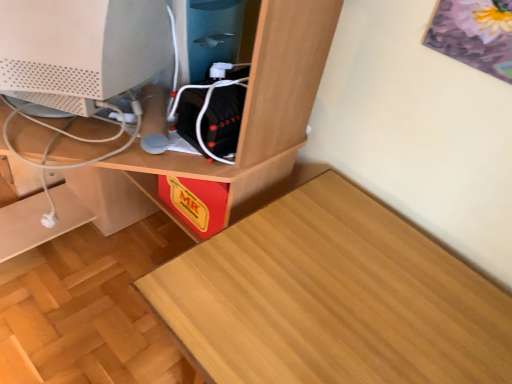
The height and width of the screenshot is (384, 512). What are the coordinates of `vacant space underneath wooden desk at center (from a real-world perspective)` in the screenshot? It's located at (94, 282).